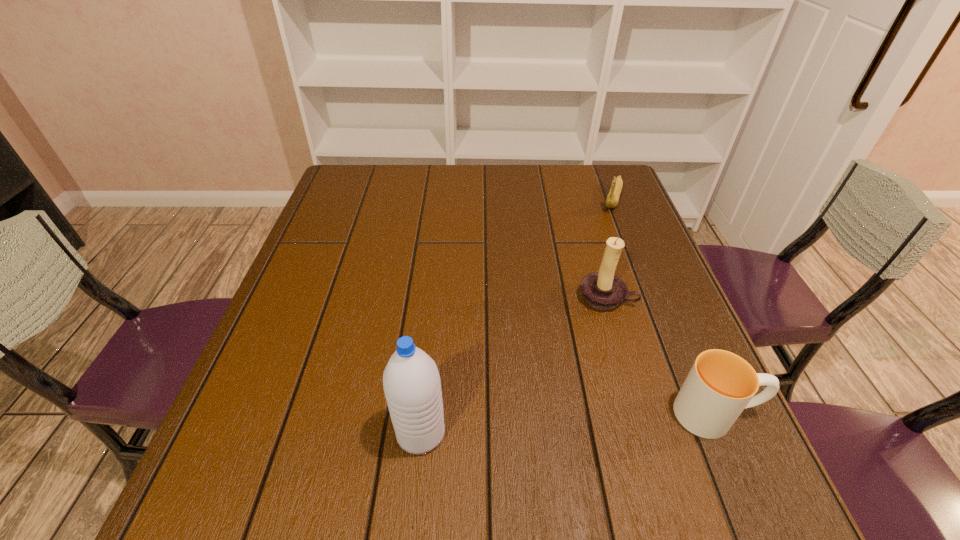
In order to click on object situated at the near right corner in this screenshot , I will do `click(720, 385)`.

This screenshot has width=960, height=540. Identify the location of vacant space at the far edge. point(558,196).

Find the location of a particular element. vacant space at the near edge of the desktop is located at coordinates (535, 437).

The height and width of the screenshot is (540, 960). I want to click on vacant space at the left edge, so click(x=344, y=303).

In the image, there is a desktop. What are the coordinates of `vacant space at the right edge` in the screenshot? It's located at click(643, 228).

You are a GUI agent. You are given a task and a screenshot of the screen. Output one action in this format:
    pyautogui.click(x=<x>, y=<y>)
    Task: Click on the free region at the near left corner of the desktop
    The image size is (960, 540).
    Given the screenshot: What is the action you would take?
    pyautogui.click(x=258, y=447)

In the image, there is a desktop. At what (x,y) coordinates should I click in order to perform the action: click on vacant space at the far right corner. Please return your answer as a coordinate pair (x, y). The height and width of the screenshot is (540, 960). Looking at the image, I should click on (624, 195).

The image size is (960, 540). I want to click on free space at the near right corner, so click(742, 445).

The image size is (960, 540). I want to click on empty space between the second tallest object and the tallest object, so click(514, 365).

At what (x,y) coordinates should I click in order to perform the action: click on free area in between the banana and the cup. Please return your answer as a coordinate pair (x, y). Image resolution: width=960 pixels, height=540 pixels. Looking at the image, I should click on (664, 306).